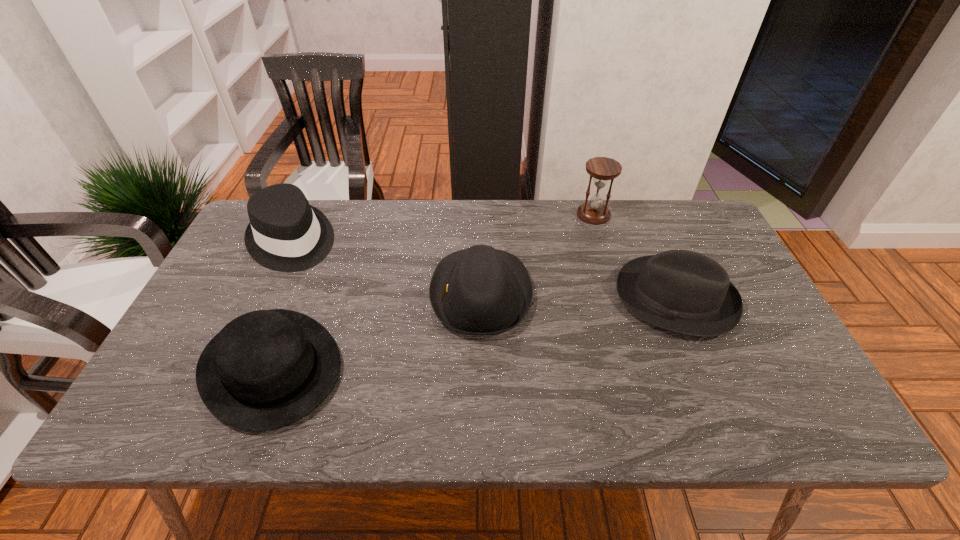
Where is `blank area at the far right corner`? This screenshot has height=540, width=960. blank area at the far right corner is located at coordinates (687, 215).

I want to click on free space between the third fedora from left to right and the hourglass, so (x=538, y=254).

This screenshot has width=960, height=540. I want to click on free space between the hourglass and the rightmost fedora, so click(635, 256).

Identify the location of free space that is in between the shortest object and the third object from left to right. The image size is (960, 540). (376, 330).

I want to click on free point between the tallest object and the third object from right to left, so click(538, 254).

What are the coordinates of `unoccupied position between the hourglass and the third fedora from left to right` in the screenshot? It's located at (538, 254).

Locate an element on the screen. empty space between the tallest object and the third object from left to right is located at coordinates (538, 254).

Find the location of `the fourth closest object to the shortest object`. the fourth closest object to the shortest object is located at coordinates (602, 169).

Where is `object that is the third nearest to the second fedora from right to left`? The height and width of the screenshot is (540, 960). object that is the third nearest to the second fedora from right to left is located at coordinates (602, 169).

This screenshot has width=960, height=540. Identify the location of fedora object that ranks as the third closest to the third object from left to right. (285, 233).